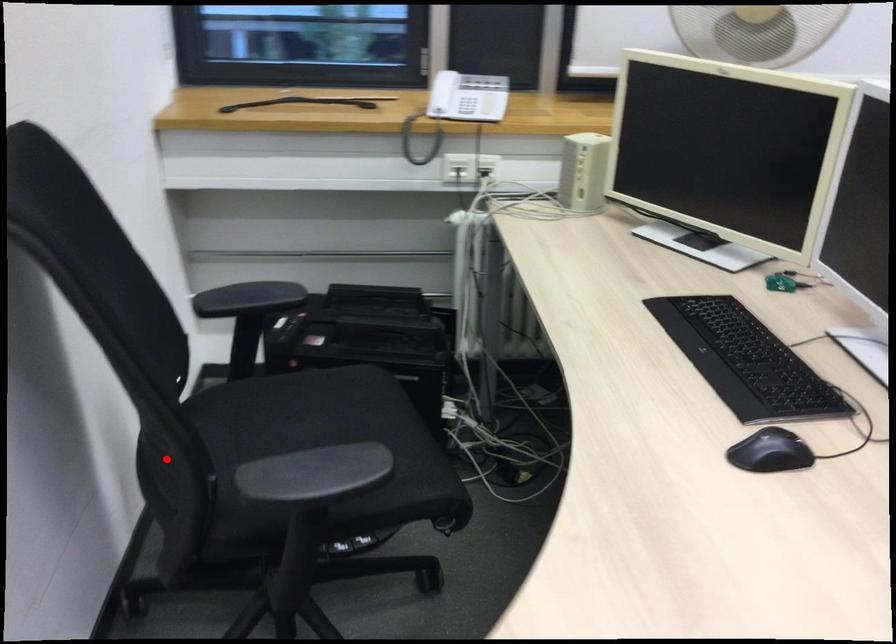
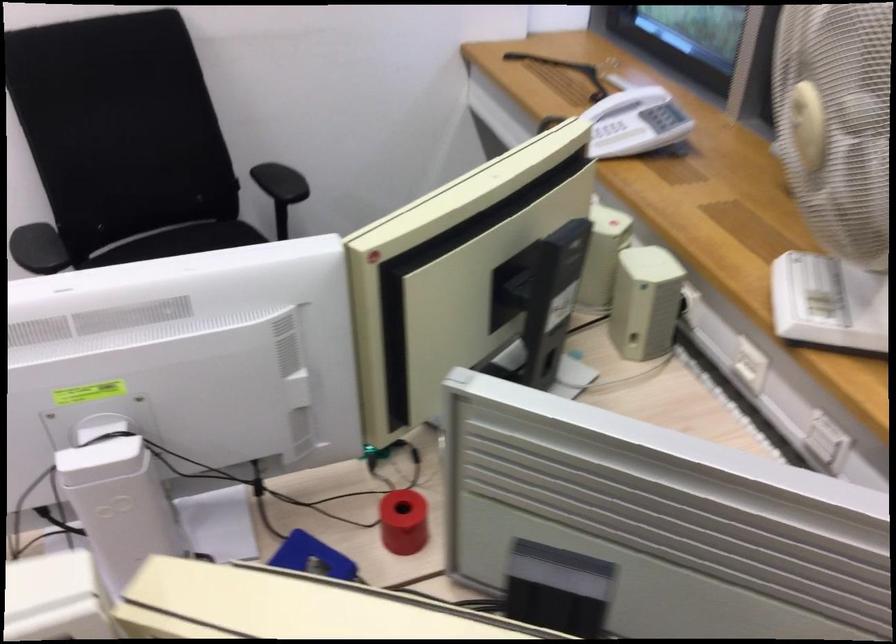
Locate, in the second image, the point that corresponds to the highlighted location in the first image.

(179, 240)